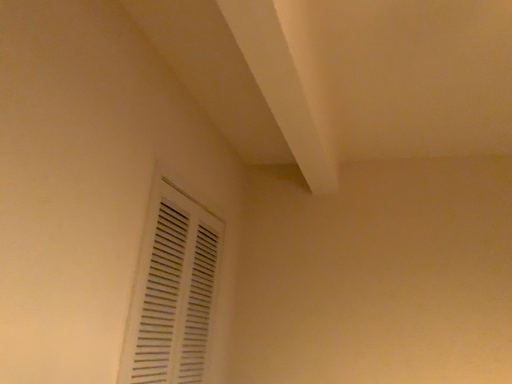
Locate an element on the screen. The width and height of the screenshot is (512, 384). white plastic vent at lower left is located at coordinates (172, 290).

The width and height of the screenshot is (512, 384). What do you see at coordinates (172, 290) in the screenshot?
I see `white plastic vent at lower left` at bounding box center [172, 290].

In order to click on white plastic vent at lower left in this screenshot , I will do `click(172, 290)`.